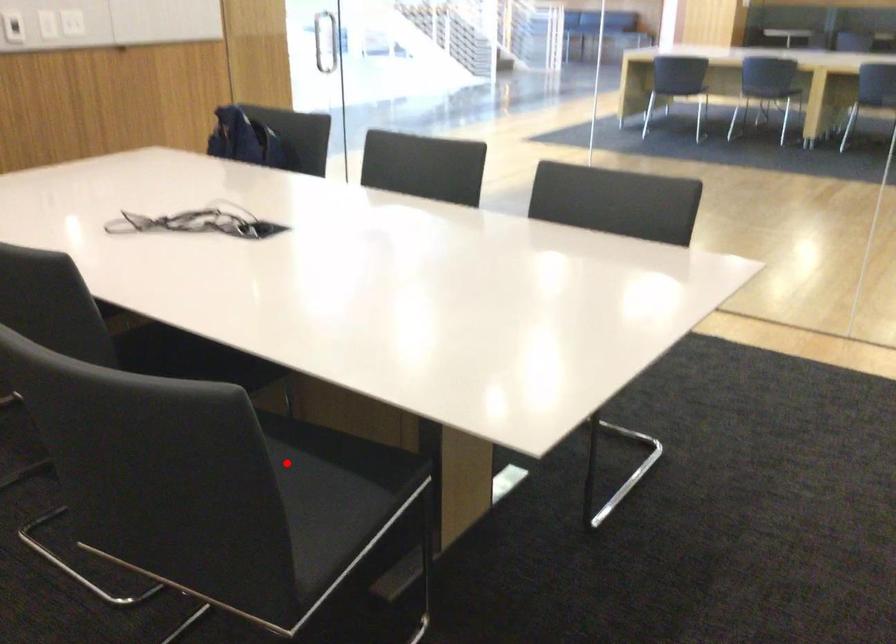
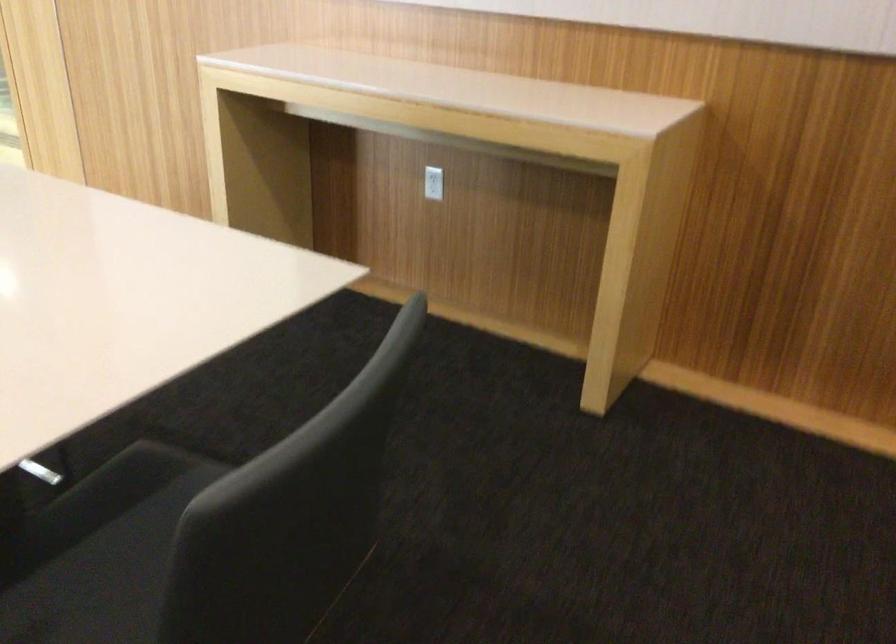
Question: I am providing you with two images of the same scene from different viewpoints. Given a red point in image1, look at the same physical point in image2. Is it:

Choices:
 (A) Closer to the viewpoint
 (B) Farther from the viewpoint

Answer: (A)